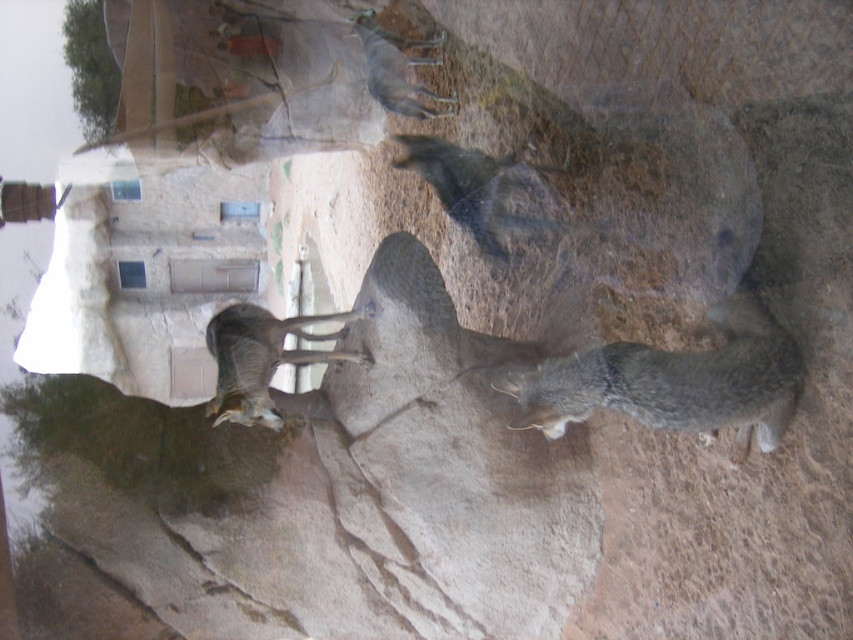
You are standing in a zoo enclosure and see the gray fur cat at lower right. If you want to feed the cat, which is 1.5 meters away from the feeding station, can you reach the feeding station without moving closer to the cat?

The gray fur cat at lower right and viewer are 1.51 meters apart from each other. Since the feeding station is 1.5 meters away from the cat, you would need to move 0.01 meters away from the cat to reach it, so yes, you can reach the feeding station without moving closer.

You are standing at the entrance of the zoo exhibit and see two points marked in the image. The first point is at coordinate point (691, 394) and the second is at point (306, 317). Which point is closer to you from your current position?

Point (691, 394) is in front of point (306, 317), so it is closer to you.

You are a zookeeper observing the gray fur antelope at center and the gray fur goat at upper center from the front of their enclosure. Which animal would you need to walk towards first to feed them, considering their positions?

The gray fur antelope at center is closer to the viewer than the gray fur goat at upper center, so you should walk towards the gray fur antelope at center first.